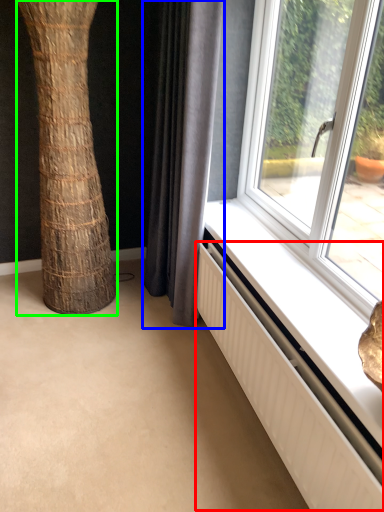
Question: Which object is the farthest from radiator (highlighted by a red box)? Choose among these: curtain (highlighted by a blue box) or tree trunk (highlighted by a green box).

Choices:
 (A) curtain
 (B) tree trunk

Answer: (B)